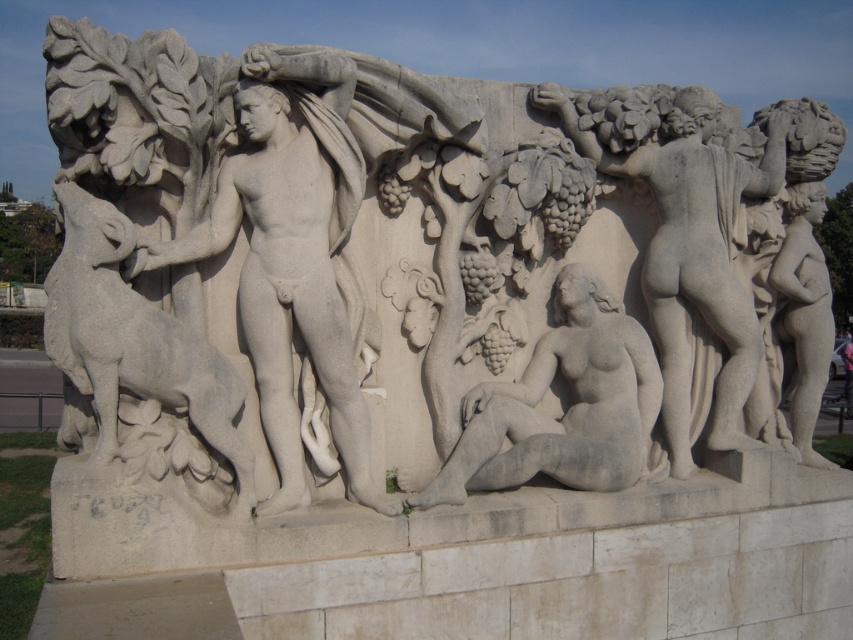
You are standing in front of the white stone statue at left and want to take a photo with your camera. The camera has a focal length of 50mm and you want to capture the entire statue in the frame. Given that the statue is 2.10 meters tall and your camera sensor has a height of 24mm, what distance should you maintain between yourself and the statue to ensure it fits perfectly in the photo?

To capture the entire 2.10 meter tall statue in the frame with a 50mm lens and a 24mm sensor height, the required distance can be calculated using the formula distance equals focal length multiplied by real height divided by sensor height. This gives 50mm multiplied by 2100mm divided by 24mm, resulting in approximately 437.5 meters. However, since the white stone statue at left and camera are 5.40 meters apart from each other, you are already within the required distance and can take the photo without any

You are an art conservator examining the stone relief sculpture. You need to determine if a protective covering designed for the narrower of the two figures will fit the white stone statue at left or the white marble figure at right. Which figure should the covering be applied to?

The white stone statue at left has a lesser width compared to the white marble figure at right, so the protective covering designed for the narrower figure should be applied to the white stone statue at left.

You are an art conservator examining the stone relief sculpture. You need to determine the relative sizes of the two figures to plan conservation efforts. Which of the two figures, the white stone statue at left or the white marble figure at right, is taller?

The white stone statue at left is taller than the white marble figure at right according to the description provided.